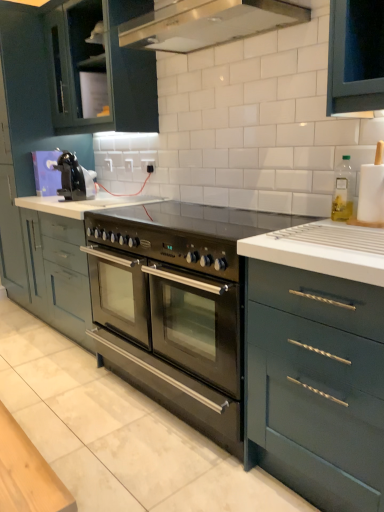
Question: Would you say matte gray cabinets at center, the 2th cabinetry from the bottom, is inside or outside stainless steel gas stove at center?

Choices:
 (A) inside
 (B) outside

Answer: (B)

Question: Is matte gray cabinets at center, the 2th cabinetry from the top, in front of or behind stainless steel gas stove at center in the image?

Choices:
 (A) behind
 (B) front

Answer: (A)

Question: Which object is positioned closest to the stainless steel gas stove at center?

Choices:
 (A) matte gray cabinets at center, the 2th cabinetry from the top
 (B) clear glass bottle at upper right, positioned as the second appliance in front-to-back order
 (C) matte black coffee maker at left
 (D) stainless steel oven at center, arranged as the 1th cabinetry when ordered from the bottom
 (E) black plastic outlet at center

Answer: (B)

Question: Based on their relative distances, which object is farther from the matte gray cabinets at center, the 2th cabinetry from the bottom?

Choices:
 (A) stainless steel gas stove at center
 (B) clear glass bottle at upper right, positioned as the second appliance in front-to-back order
 (C) white matte paper towel holder at right, which is the 1th appliance in front-to-back order
 (D) black plastic outlet at center
 (E) matte black coffee maker at left

Answer: (C)